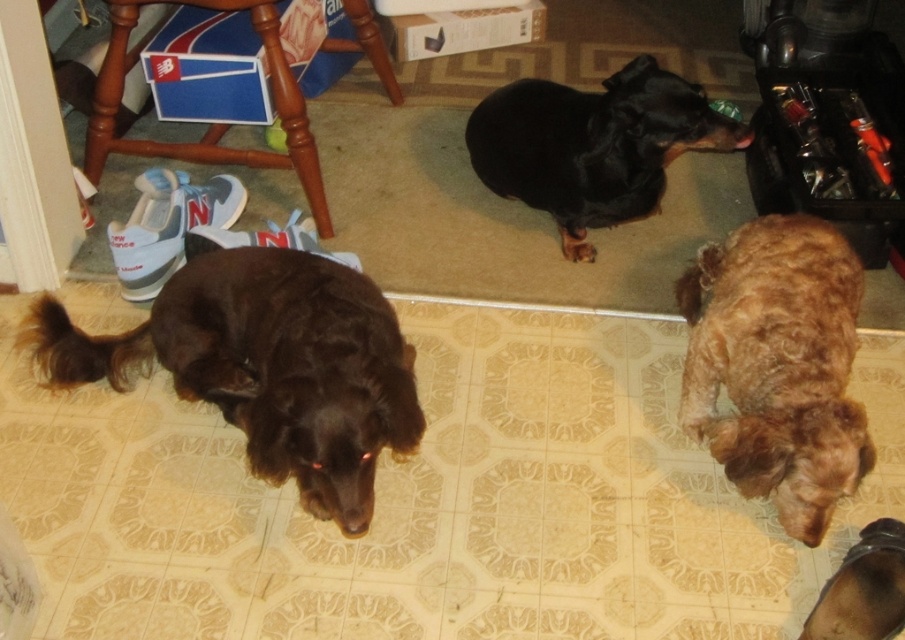
Looking at this image, can you confirm if brown wood stool at upper left is positioned to the right of brown furry dog at lower right?

No, brown wood stool at upper left is not to the right of brown furry dog at lower right.

Can you confirm if brown wood stool at upper left is bigger than brown furry dog at lower right?

Indeed, brown wood stool at upper left has a larger size compared to brown furry dog at lower right.

Who is more forward, (298,166) or (886,580)?

Positioned in front is point (886,580).

Identify the location of brown wood stool at upper left. tap(211, 124).

Is brown furry dog at center thinner than brown furry dog at lower right?

In fact, brown furry dog at center might be wider than brown furry dog at lower right.

Is brown furry dog at center wider than brown furry dog at lower right?

Yes, brown furry dog at center is wider than brown furry dog at lower right.

Locate an element on the screen. Image resolution: width=905 pixels, height=640 pixels. brown furry dog at center is located at coordinates (265, 365).

Which is in front, point (705, 385) or point (197, 148)?

Positioned in front is point (705, 385).

Is shiny brown fur at lower right shorter than brown wood stool at upper left?

No, shiny brown fur at lower right is not shorter than brown wood stool at upper left.

I want to click on shiny brown fur at lower right, so click(x=777, y=364).